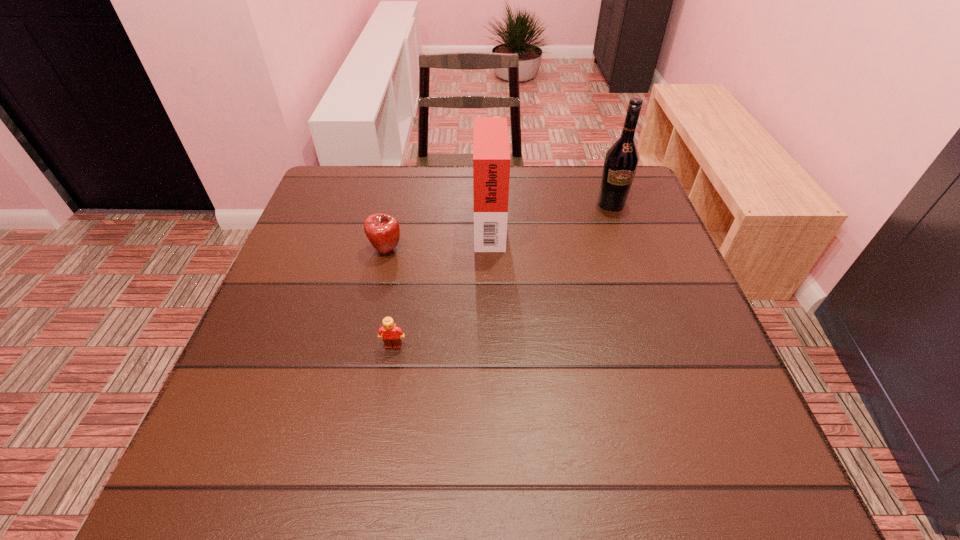
Where is `the rightmost object`? The image size is (960, 540). the rightmost object is located at coordinates (622, 158).

At what (x,y) coordinates should I click in order to perform the action: click on cigarette case. Please return your answer as a coordinate pair (x, y). Looking at the image, I should click on (491, 154).

Locate an element on the screen. This screenshot has height=540, width=960. the second shortest object is located at coordinates (382, 230).

Image resolution: width=960 pixels, height=540 pixels. I want to click on Lego, so click(x=392, y=335).

The height and width of the screenshot is (540, 960). I want to click on the nearest object, so click(392, 335).

Locate an element on the screen. free spot located on the label of the wine bottle is located at coordinates (653, 323).

This screenshot has height=540, width=960. I want to click on free region located on the front-facing side of the cigarette case, so click(x=373, y=222).

I want to click on blank area located on the front-facing side of the cigarette case, so coord(385,222).

The width and height of the screenshot is (960, 540). I want to click on vacant point located on the front-facing side of the cigarette case, so click(x=409, y=222).

Locate an element on the screen. The width and height of the screenshot is (960, 540). vacant point located 0.220m on the front of the third tallest object is located at coordinates (367, 337).